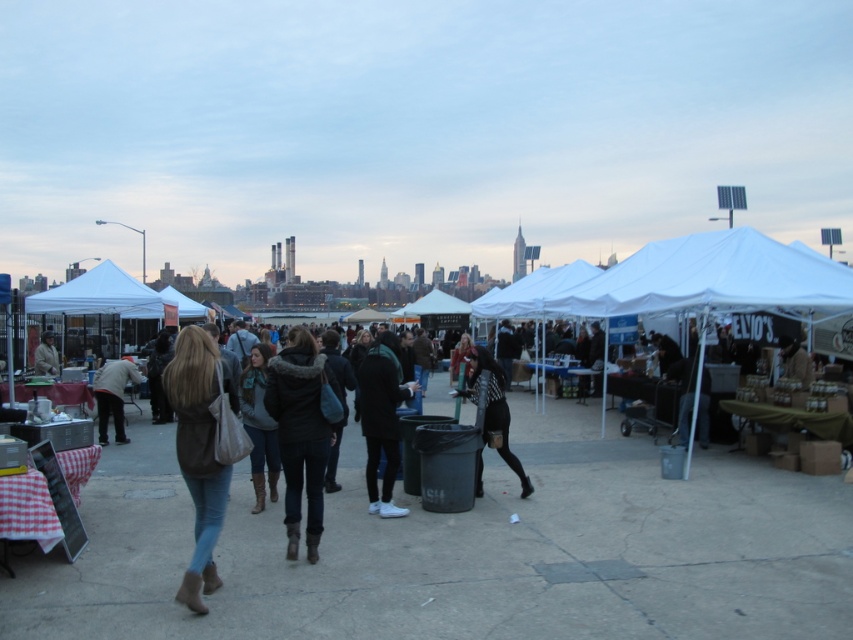
Question: Which of these objects is positioned closest to the black leather jacket at center?

Choices:
 (A) dark green jacket at center
 (B) black fur-trimmed coat at center

Answer: (A)

Question: Is white fabric canopy at center to the left of black fur-trimmed coat at center from the viewer's perspective?

Choices:
 (A) yes
 (B) no

Answer: (B)

Question: Where is white fabric canopy at center located in relation to black leather jacket at center in the image?

Choices:
 (A) above
 (B) below

Answer: (A)

Question: Among these objects, which one is farthest from the camera?

Choices:
 (A) black leather jacket at center
 (B) white fabric tent at center
 (C) black fur-trimmed coat at center

Answer: (A)

Question: Does black fur-trimmed coat at center have a larger size compared to dark green jacket at center?

Choices:
 (A) no
 (B) yes

Answer: (A)

Question: Estimate the real-world distances between objects in this image. Which object is farther from the matte brown jacket at center?

Choices:
 (A) leather jacket at left
 (B) black leather jacket at center
 (C) white fabric tent at center
 (D) dark green jacket at center

Answer: (A)